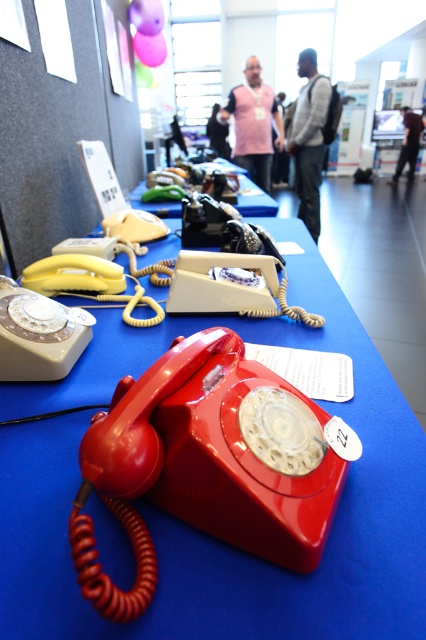
Between point (201, 445) and point (100, 131), which one is positioned in front?

Positioned in front is point (201, 445).

Does matte red telephone at center appear on the left side of matte white paper at upper left?

In fact, matte red telephone at center is to the right of matte white paper at upper left.

Is point (256, 518) closer to viewer compared to point (118, 122)?

Yes, it is.

Locate an element on the screen. This screenshot has width=426, height=640. matte red telephone at center is located at coordinates (196, 470).

Who is positioned more to the right, matte plastic telephone at center or gray sweater at center?

Positioned to the right is gray sweater at center.

Between point (28, 497) and point (328, 93), which one is positioned in front?

Positioned in front is point (28, 497).

Between point (241, 586) and point (314, 65), which one is positioned behind?

The point (314, 65) is behind.

Identify the location of matte plastic telephone at center. (204, 532).

Is matte white paper at upper left to the right of pink fabric vest at center from the viewer's perspective?

No, matte white paper at upper left is not to the right of pink fabric vest at center.

Can you confirm if matte white paper at upper left is smaller than pink fabric vest at center?

Yes, matte white paper at upper left is smaller than pink fabric vest at center.

Where is `matte white paper at upper left`? matte white paper at upper left is located at coordinates (58, 134).